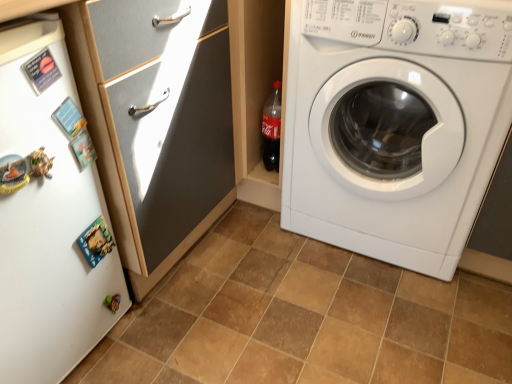
Question: Can brown matte tile at center be found inside white matte refrigerator at left?

Choices:
 (A) no
 (B) yes

Answer: (A)

Question: Is white matte refrigerator at left taller than brown matte tile at center?

Choices:
 (A) no
 (B) yes

Answer: (B)

Question: From a real-world perspective, is white matte refrigerator at left below brown matte tile at center?

Choices:
 (A) yes
 (B) no

Answer: (B)

Question: Is the depth of white matte refrigerator at left less than that of brown matte tile at center?

Choices:
 (A) no
 (B) yes

Answer: (B)

Question: Is the position of white matte refrigerator at left more distant than that of brown matte tile at center?

Choices:
 (A) yes
 (B) no

Answer: (B)

Question: From the image's perspective, does white matte refrigerator at left appear lower than brown matte tile at center?

Choices:
 (A) yes
 (B) no

Answer: (B)

Question: Does white glossy cabinet at upper left have a larger size compared to white glossy washing machine at right?

Choices:
 (A) no
 (B) yes

Answer: (A)

Question: Can you confirm if white glossy cabinet at upper left is taller than white glossy washing machine at right?

Choices:
 (A) no
 (B) yes

Answer: (B)

Question: Could you tell me if white glossy cabinet at upper left is facing white glossy washing machine at right?

Choices:
 (A) no
 (B) yes

Answer: (A)

Question: Would you say white glossy cabinet at upper left is a long distance from white glossy washing machine at right?

Choices:
 (A) no
 (B) yes

Answer: (A)

Question: Considering the relative positions of white glossy cabinet at upper left and white glossy washing machine at right in the image provided, is white glossy cabinet at upper left to the right of white glossy washing machine at right from the viewer's perspective?

Choices:
 (A) yes
 (B) no

Answer: (B)

Question: Does white glossy cabinet at upper left have a smaller size compared to white glossy washing machine at right?

Choices:
 (A) yes
 (B) no

Answer: (A)

Question: Is the surface of white glossy washing machine at right in direct contact with brown matte tile at center?

Choices:
 (A) no
 (B) yes

Answer: (A)